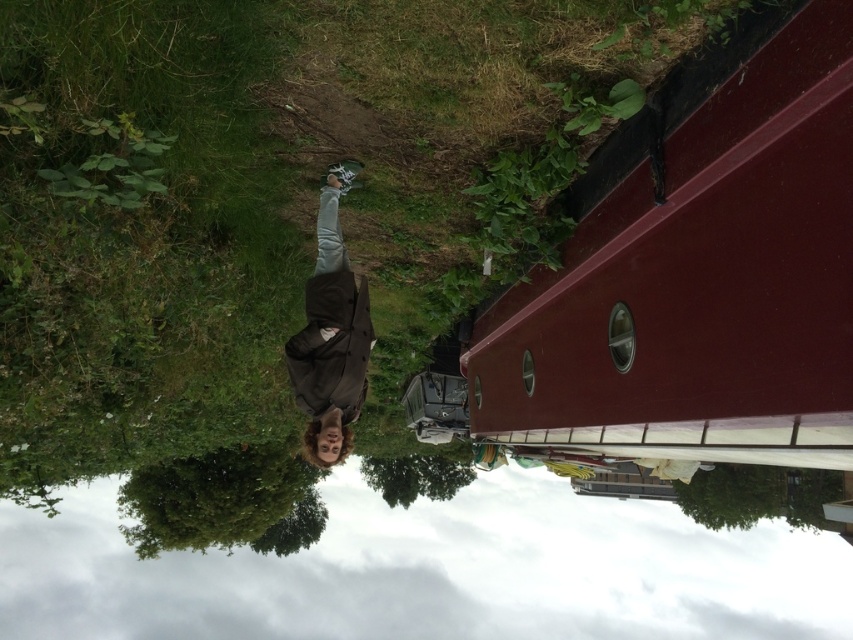
Question: Considering the relative positions of transparent plastic water at lower center and brown fabric jacket at center in the image provided, where is transparent plastic water at lower center located with respect to brown fabric jacket at center?

Choices:
 (A) right
 (B) left

Answer: (A)

Question: Which of these objects is positioned closest to the maroon smooth boat at upper right?

Choices:
 (A) brown fabric jacket at center
 (B) transparent plastic water at lower center

Answer: (A)

Question: Does maroon smooth boat at upper right appear under transparent plastic water at lower center?

Choices:
 (A) yes
 (B) no

Answer: (B)

Question: Which object is closer to the camera taking this photo?

Choices:
 (A) maroon smooth boat at upper right
 (B) transparent plastic water at lower center

Answer: (A)

Question: Is transparent plastic water at lower center wider than brown fabric jacket at center?

Choices:
 (A) no
 (B) yes

Answer: (B)

Question: Which point is farther to the camera?

Choices:
 (A) brown fabric jacket at center
 (B) maroon smooth boat at upper right

Answer: (A)